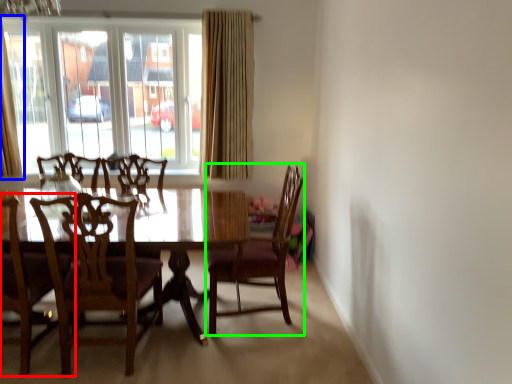
Question: Which object is positioned closest to chair (highlighted by a red box)? Select from curtain (highlighted by a blue box) and chair (highlighted by a green box).

Choices:
 (A) curtain
 (B) chair

Answer: (B)